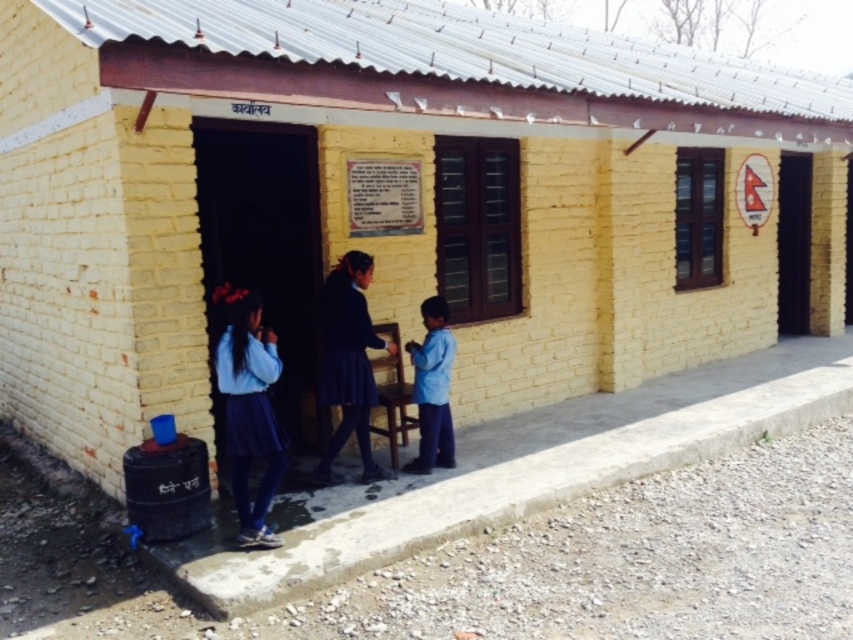
Question: Does dark blue skirt at center have a lesser width compared to blue cotton shirt at lower center?

Choices:
 (A) no
 (B) yes

Answer: (A)

Question: Among these points, which one is farthest from the camera?

Choices:
 (A) (421, 368)
 (B) (323, 451)

Answer: (B)

Question: Estimate the real-world distances between objects in this image. Which object is farther from the dark blue skirt at center?

Choices:
 (A) matte blue skirt at lower left
 (B) blue cotton shirt at lower center

Answer: (A)

Question: Is matte blue skirt at lower left closer to the viewer compared to blue cotton shirt at lower center?

Choices:
 (A) no
 (B) yes

Answer: (B)

Question: Observing the image, what is the correct spatial positioning of matte blue skirt at lower left in reference to dark blue skirt at center?

Choices:
 (A) below
 (B) above

Answer: (A)

Question: Which object is the farthest from the dark blue skirt at center?

Choices:
 (A) blue cotton shirt at lower center
 (B) matte blue skirt at lower left

Answer: (B)